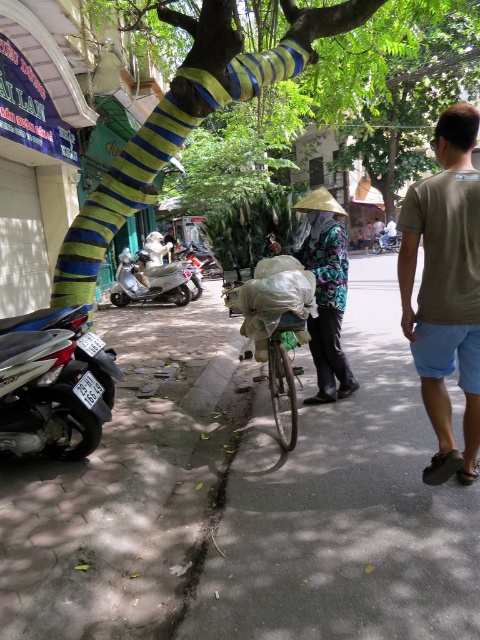
Between floral fabric hat at center and green matte bicycle at center, which one appears on the left side from the viewer's perspective?

green matte bicycle at center is more to the left.

Looking at this image, can you confirm if floral fabric hat at center is smaller than green matte bicycle at center?

Incorrect, floral fabric hat at center is not smaller in size than green matte bicycle at center.

Where is `floral fabric hat at center`? The image size is (480, 640). floral fabric hat at center is located at coordinates [326, 292].

Between striped fabric tree at upper center and green matte bicycle at center, which one is positioned lower?

green matte bicycle at center

Where is `striped fabric tree at upper center`? This screenshot has height=640, width=480. striped fabric tree at upper center is located at coordinates (190, 116).

In order to click on striped fabric tree at upper center in this screenshot , I will do `click(190, 116)`.

In the scene shown: Does paved concrete sidewalk at lower left have a smaller size compared to green matte bicycle at center?

Correct, paved concrete sidewalk at lower left occupies less space than green matte bicycle at center.

What do you see at coordinates (243, 499) in the screenshot? I see `paved concrete sidewalk at lower left` at bounding box center [243, 499].

Where is `paved concrete sidewalk at lower left`? paved concrete sidewalk at lower left is located at coordinates (243, 499).